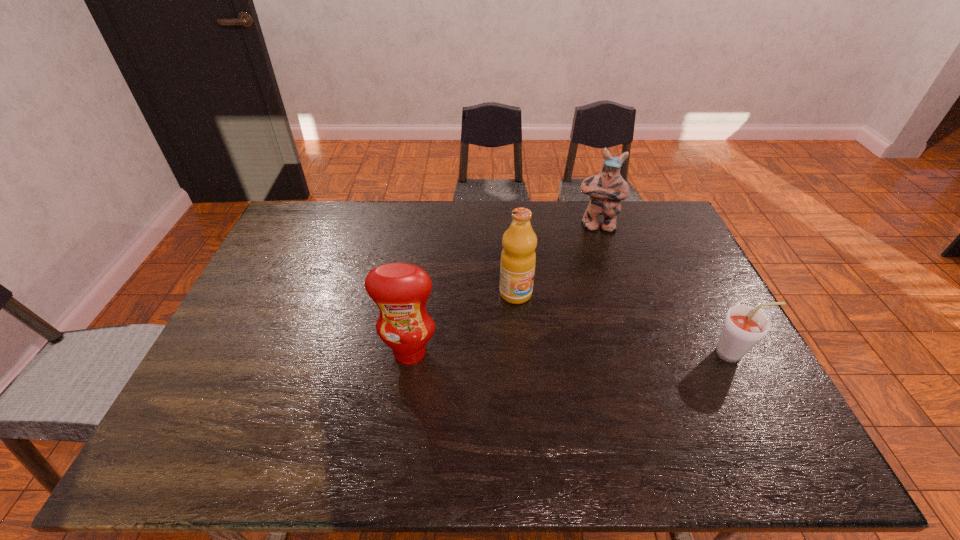
The width and height of the screenshot is (960, 540). Find the location of `vacant area that lies between the figurine and the root beer`. vacant area that lies between the figurine and the root beer is located at coordinates (665, 290).

The image size is (960, 540). In order to click on the third closest object relative to the fruit juice in this screenshot , I will do `click(744, 326)`.

Identify which object is located as the nearest to the shortest object. Please provide its 2D coordinates. Your answer should be formatted as a tuple, i.e. [(x, y)], where the tuple contains the x and y coordinates of a point satisfying the conditions above.

[(518, 258)]

At what (x,y) coordinates should I click in order to perform the action: click on free region that satisfies the following two spatial constraints: 1. on the label side of the condiment; 2. on the drink side of the shortest object. Please return your answer as a coordinate pair (x, y). Looking at the image, I should click on (410, 354).

This screenshot has height=540, width=960. I want to click on vacant area that satisfies the following two spatial constraints: 1. on the front side of the fruit juice; 2. on the drink side of the shortest object, so coord(520,354).

The height and width of the screenshot is (540, 960). In order to click on free space in the image that satisfies the following two spatial constraints: 1. on the front side of the shortest object; 2. on the drink side of the third nearest object in this screenshot , I will do `click(520, 354)`.

This screenshot has height=540, width=960. I want to click on free space in the image that satisfies the following two spatial constraints: 1. on the label side of the condiment; 2. on the drink side of the rightmost object, so click(x=410, y=354).

The height and width of the screenshot is (540, 960). Find the location of `free spot that satisfies the following two spatial constraints: 1. on the back side of the fruit juice; 2. on the left side of the figurine`. free spot that satisfies the following two spatial constraints: 1. on the back side of the fruit juice; 2. on the left side of the figurine is located at coordinates (510, 227).

In order to click on vacant space that satisfies the following two spatial constraints: 1. on the label side of the condiment; 2. on the drink side of the rightmost object in this screenshot , I will do `click(410, 354)`.